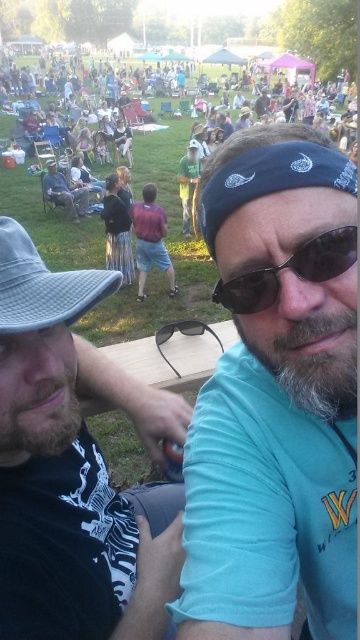
Question: Considering the relative positions of beige fabric hat at left and dark brown fuzzy beard at lower left in the image provided, where is beige fabric hat at left located with respect to dark brown fuzzy beard at lower left?

Choices:
 (A) above
 (B) below

Answer: (B)

Question: Which point is farther from the camera taking this photo?

Choices:
 (A) (78, 220)
 (B) (246, 282)

Answer: (A)

Question: Considering the real-world distances, which object is farthest from the black plastic goggles at center?

Choices:
 (A) sunglasses at center
 (B) matte black jacket at center
 (C) gray fabric baseball hat at left

Answer: (B)

Question: Can you confirm if beige fabric hat at left is positioned below matte black jacket at center?

Choices:
 (A) yes
 (B) no

Answer: (A)

Question: Estimate the real-world distances between objects in this image. Which object is farther from the gray fabric baseball hat at left?

Choices:
 (A) blue bandana at center
 (B) graywoollybeard at center
 (C) sunglasses at center

Answer: (A)

Question: Is matte black jacket at center behind black plastic goggles at center?

Choices:
 (A) no
 (B) yes

Answer: (B)